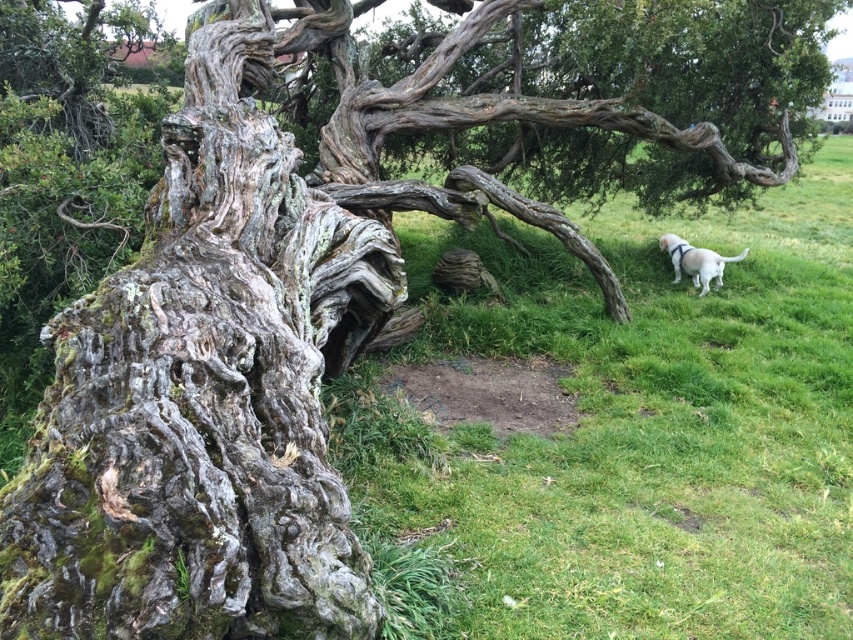
You are standing in front of the large, gnarled tree trunk and see two points marked on the tree. One is at point (225, 392) and the other is at point (706, 266). Which point is closer to you?

Point (225, 392) is closer to you than point (706, 266).

You are standing in the scene and want to walk towards the white matte dog at right. Which direction should you move relative to the green grassy at center?

You should move towards the right side of the green grassy at center to reach the white matte dog at right since the dog is positioned to the right of the grassy area.